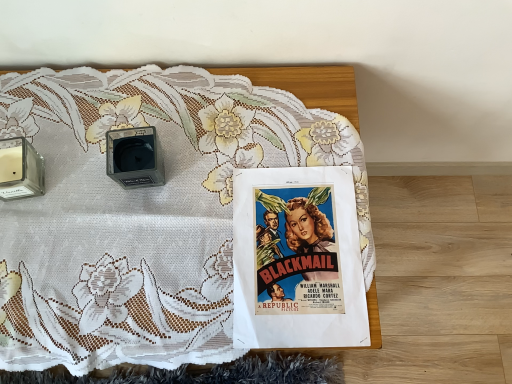
At what (x,y) coordinates should I click in order to perform the action: click on free point behind matte paper poster at center. Please return your answer as a coordinate pair (x, y). The width and height of the screenshot is (512, 384). Looking at the image, I should click on (270, 123).